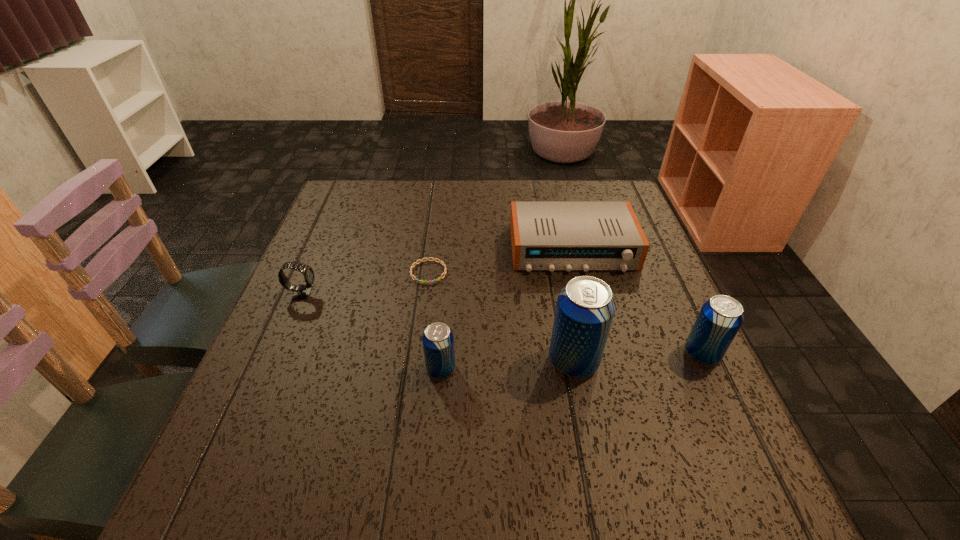
The image size is (960, 540). In order to click on empty space between the radio receiver and the shortest object in this screenshot , I will do `click(500, 260)`.

You are a GUI agent. You are given a task and a screenshot of the screen. Output one action in this format:
    pyautogui.click(x=<x>, y=<y>)
    Task: Click on the free space between the fourth nearest object and the rightmost beer can
    The width and height of the screenshot is (960, 540).
    Given the screenshot: What is the action you would take?
    pyautogui.click(x=502, y=323)

Locate an element on the screen. the closest object to the third tallest object is located at coordinates (585, 308).

This screenshot has width=960, height=540. Find the location of `the fifth closest object to the bracelet`. the fifth closest object to the bracelet is located at coordinates (720, 318).

I want to click on beer can that can be found as the closest to the leftmost object, so click(438, 340).

Select which beer can is the closest to the tallest beer can. Please provide its 2D coordinates. Your answer should be formatted as a tuple, i.e. [(x, y)], where the tuple contains the x and y coordinates of a point satisfying the conditions above.

[(720, 318)]

Image resolution: width=960 pixels, height=540 pixels. What are the coordinates of `free location that satisfies the following two spatial constraints: 1. on the face of the rightmost object; 2. on the right side of the fourth nearest object` in the screenshot? It's located at (277, 353).

Where is `free region that satisfies the following two spatial constraints: 1. on the face of the watch; 2. on the left side of the second beer can from left to right`? This screenshot has width=960, height=540. free region that satisfies the following two spatial constraints: 1. on the face of the watch; 2. on the left side of the second beer can from left to right is located at coordinates pyautogui.click(x=274, y=361).

Where is `free space in the image that satisfies the following two spatial constraints: 1. on the control panel of the second shortest object; 2. on the face of the third farthest object`? The width and height of the screenshot is (960, 540). free space in the image that satisfies the following two spatial constraints: 1. on the control panel of the second shortest object; 2. on the face of the third farthest object is located at coordinates (584, 294).

At what (x,y) coordinates should I click in order to perform the action: click on vacant space that satisfies the following two spatial constraints: 1. on the control panel of the second tallest object; 2. on the left side of the fifth tallest object. Please return your answer as a coordinate pair (x, y). The image size is (960, 540). Looking at the image, I should click on (599, 353).